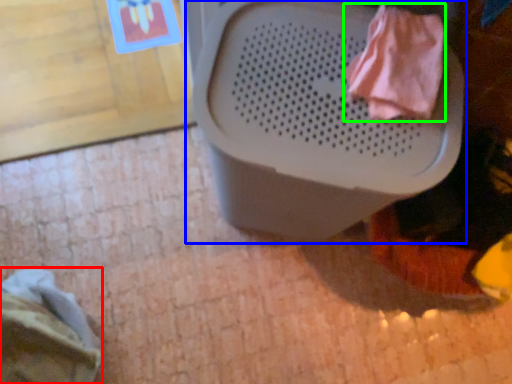
Question: Considering the real-world distances, which object is farthest from clothing (highlighted by a red box)? waste container (highlighted by a blue box) or clothing (highlighted by a green box)?

Choices:
 (A) waste container
 (B) clothing

Answer: (B)